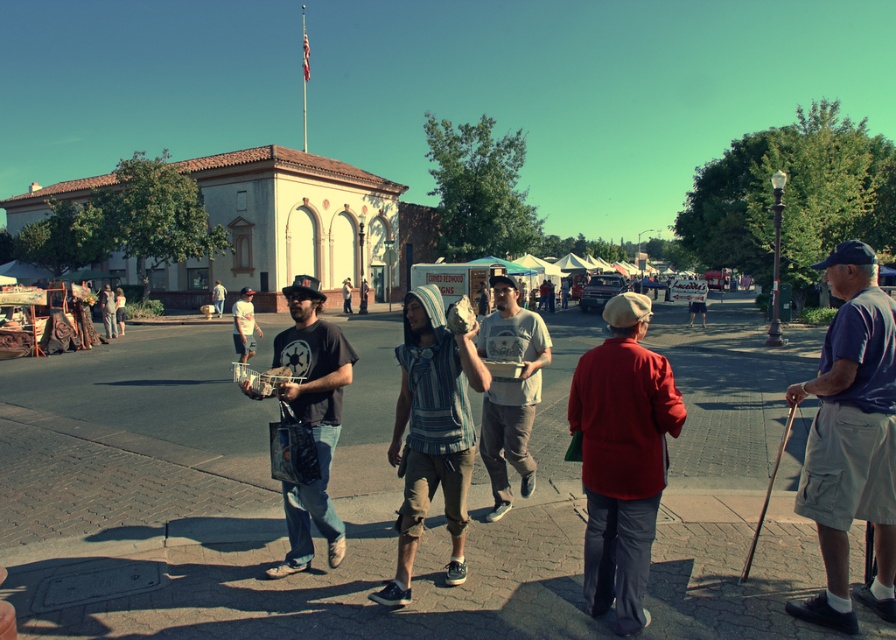
Question: Among these points, which one is farthest from the camera?

Choices:
 (A) (431, 296)
 (B) (841, 337)

Answer: (A)

Question: Considering the real-world distances, which object is farthest from the matte black t-shirt at center?

Choices:
 (A) brick pavement at center
 (B) red cotton jacket at center
 (C) striped cotton hoodie at center

Answer: (A)

Question: Can you confirm if matte black t-shirt at center is smaller than light gray cotton t-shirt at center?

Choices:
 (A) no
 (B) yes

Answer: (A)

Question: Observing the image, what is the correct spatial positioning of brick pavement at center in reference to blue cotton shirt at right?

Choices:
 (A) below
 (B) above

Answer: (A)

Question: Estimate the real-world distances between objects in this image. Which object is closer to the blue cotton shirt at right?

Choices:
 (A) light gray cotton t-shirt at center
 (B) matte black t-shirt at center
 (C) brick pavement at center
 (D) striped cotton hoodie at center

Answer: (D)

Question: Considering the relative positions of brick pavement at center and matte black t-shirt at center in the image provided, where is brick pavement at center located with respect to matte black t-shirt at center?

Choices:
 (A) left
 (B) right

Answer: (B)